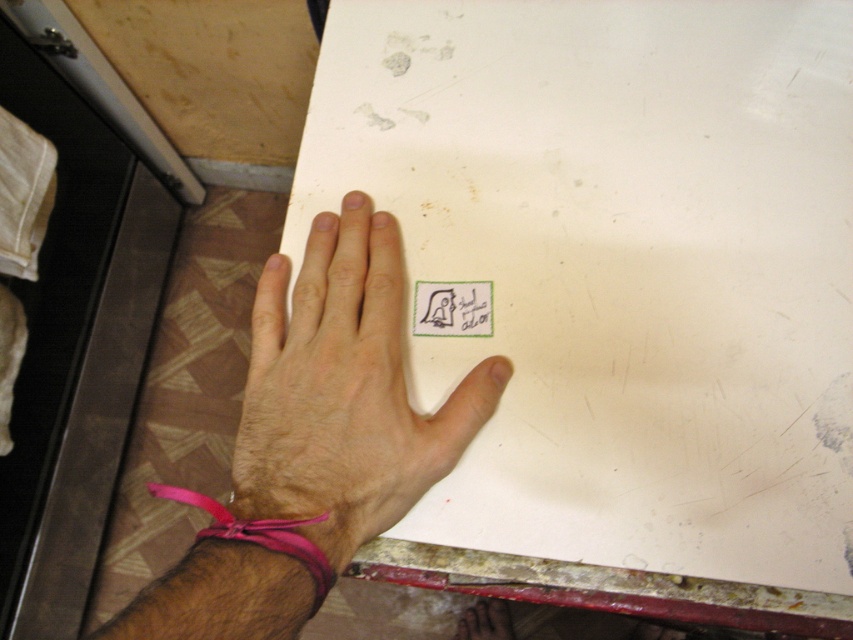
You are an artist who needs to place a new stamp on the white matte paper at center. The stamp is 1 cm in diameter. Where should you place it to avoid overlapping with existing marks? The existing marks are located at point 0.417, 0.726 in coordinates. Please provide coordinates in the same format as the given point.

Place the stamp at coordinates such as (426, 320) to avoid overlapping with the existing mark at (618, 266) on the white matte paper at center.